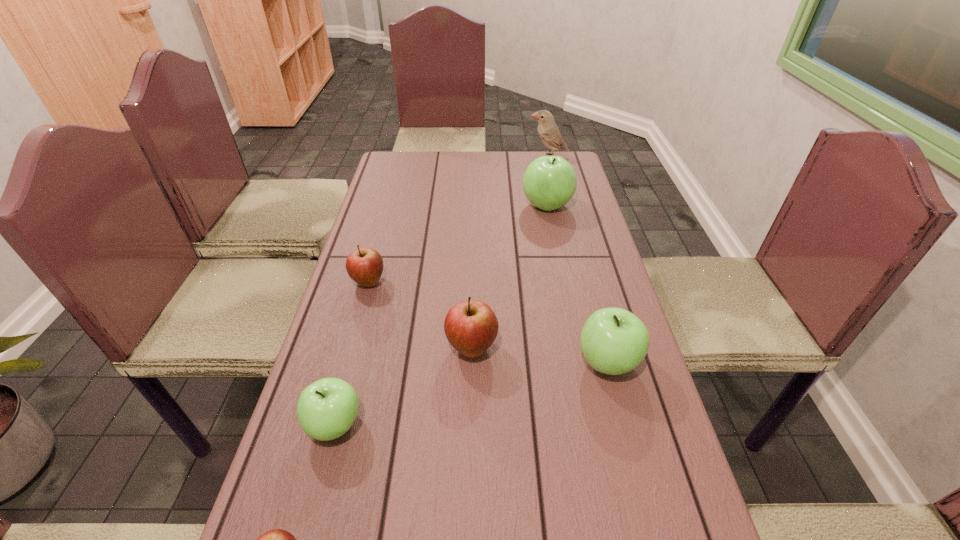
Locate an element on the screen. This screenshot has height=540, width=960. the farthest red apple is located at coordinates [365, 265].

What are the coordinates of `vacant space positioned 0.220m at the face of the white bird` in the screenshot? It's located at (472, 157).

The height and width of the screenshot is (540, 960). Find the location of `free space located 0.150m at the face of the white bird`. free space located 0.150m at the face of the white bird is located at coordinates (490, 157).

Where is `vacant space located at the face of the white bird`? vacant space located at the face of the white bird is located at coordinates (465, 157).

Find the location of a particular element. The width and height of the screenshot is (960, 540). free region located 0.230m on the front of the farthest apple is located at coordinates (560, 267).

Find the location of `vacant region located 0.140m on the right of the biggest red apple`. vacant region located 0.140m on the right of the biggest red apple is located at coordinates (558, 348).

In order to click on vacant area situated 0.130m on the left of the second biggest green apple in this screenshot , I will do `click(518, 362)`.

The width and height of the screenshot is (960, 540). What are the coordinates of `free space located on the back of the second nearest apple` in the screenshot? It's located at (x=350, y=368).

The height and width of the screenshot is (540, 960). What are the coordinates of `vacant space situated on the back of the farthest red apple` in the screenshot? It's located at (383, 228).

I want to click on object located at the far edge, so click(x=549, y=133).